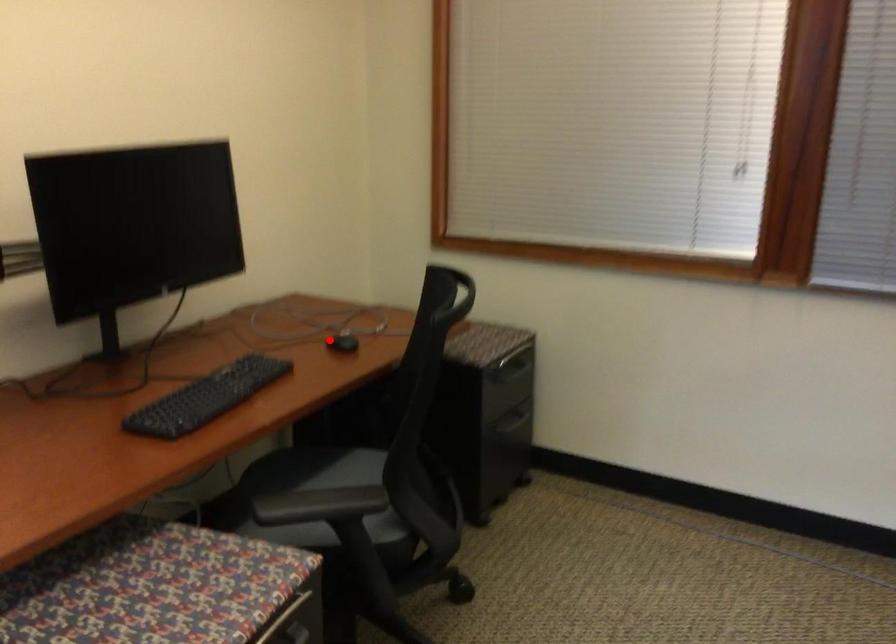
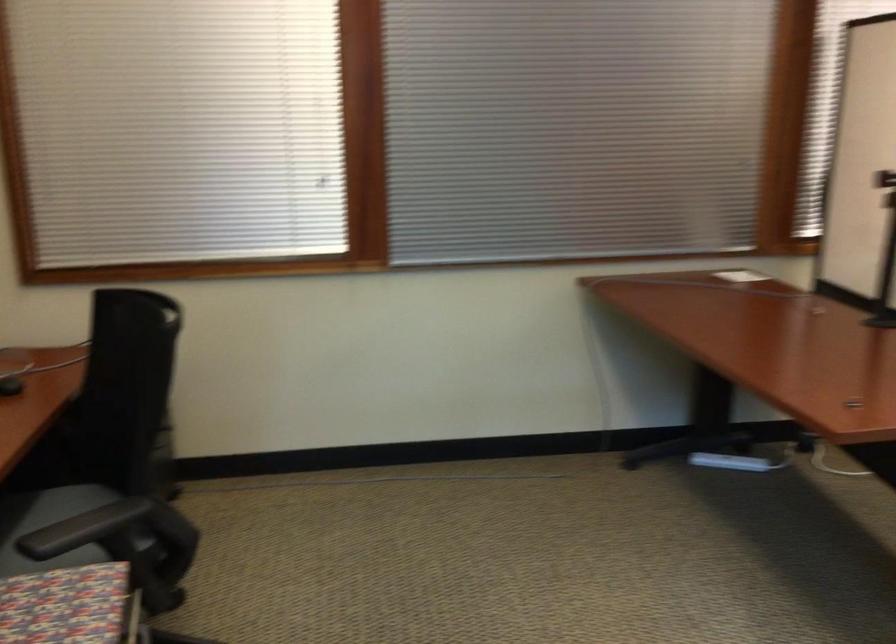
Find the pixel in the second image that matches the highlighted location in the first image.

(10, 384)